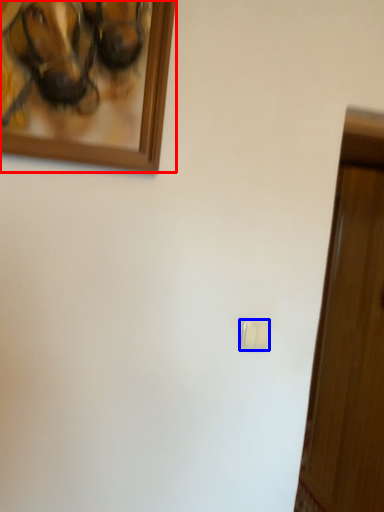
Question: Among these objects, which one is farthest to the camera, picture frame (highlighted by a red box) or light switch (highlighted by a blue box)?

Choices:
 (A) picture frame
 (B) light switch

Answer: (B)